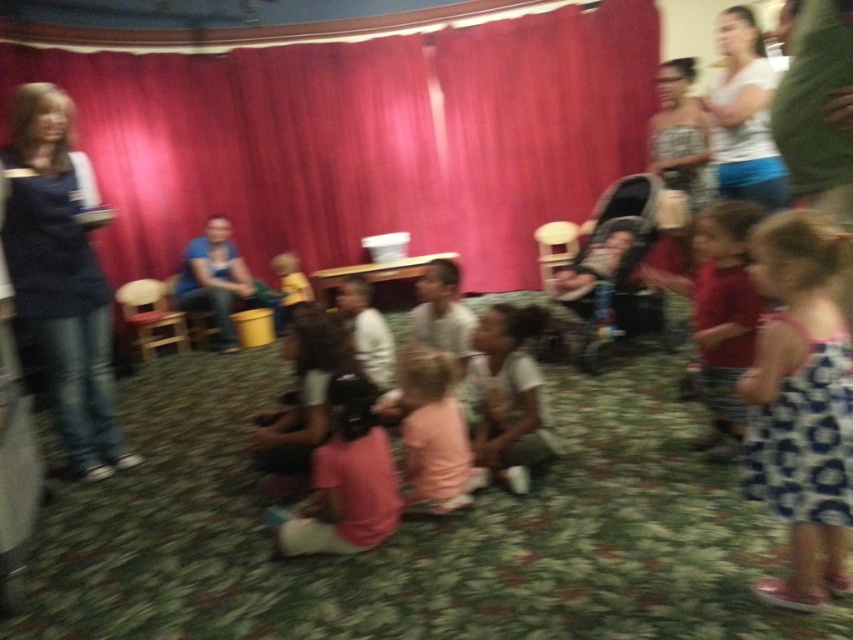
Question: Based on their relative distances, which object is farther from the white matte shirt at center?

Choices:
 (A) white dotted dress at lower right
 (B) pink fabric at center
 (C) blue denim jeans at left
 (D) pink fabric dress at center

Answer: (C)

Question: Which of the following is the closest to the observer?

Choices:
 (A) (84, 403)
 (B) (378, 456)
 (C) (585, 172)

Answer: (B)

Question: Can you confirm if blue denim jeans at left is thinner than white matte shirt at center?

Choices:
 (A) yes
 (B) no

Answer: (B)

Question: Which is farther from the blue denim jeans at left?

Choices:
 (A) white matte shirt at center
 (B) pink fabric at center

Answer: (A)

Question: Observing the image, what is the correct spatial positioning of white dotted dress at lower right in reference to blue denim jeans at left?

Choices:
 (A) above
 (B) below

Answer: (B)

Question: From the image, what is the correct spatial relationship of blue denim jeans at left in relation to pink fabric dress at center?

Choices:
 (A) right
 (B) left

Answer: (B)